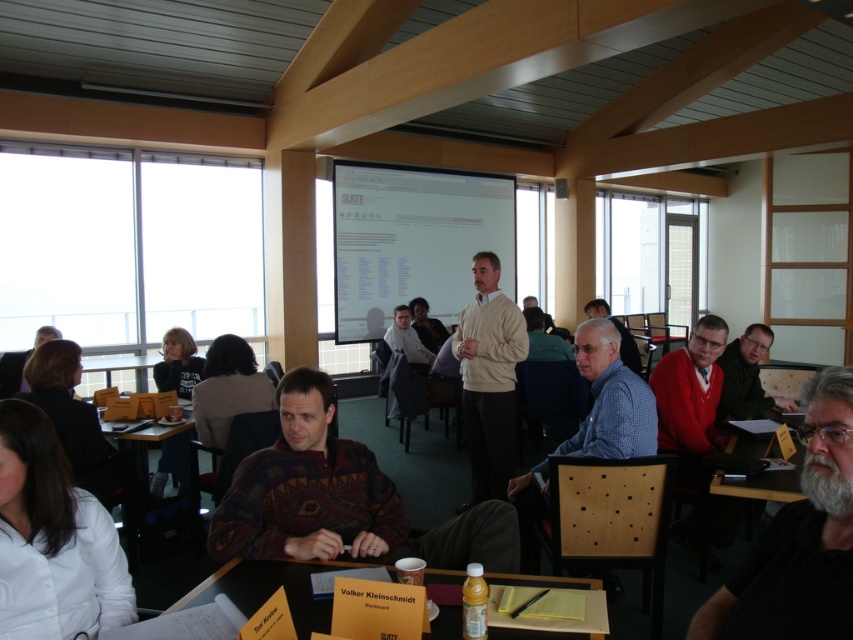
You are a guest at the conference and need to place your laptop on the wooden table at lower center. Considering the height of the dark blue sweater at center, will the table be tall enough for comfortable typing?

The wooden table at lower center has a lesser height compared to the dark blue sweater at center. Since the sweater is taller than the table, placing the laptop might make typing uncomfortable due to the lower table height.

Based on the photo, you are standing in the conference room and want to place a 1.5 meter long banner on the wooden table at lower center. Can the banner fit on the table?

The wooden table at lower center is 1.60 meters away from the viewer, but the description does not provide the table length. Therefore, it is impossible to determine if the banner will fit based on the given information.